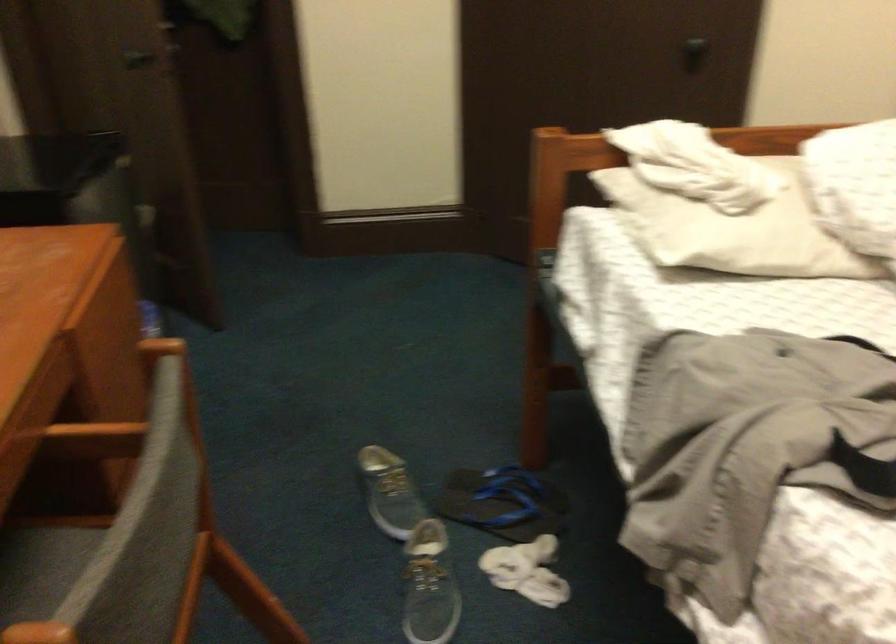
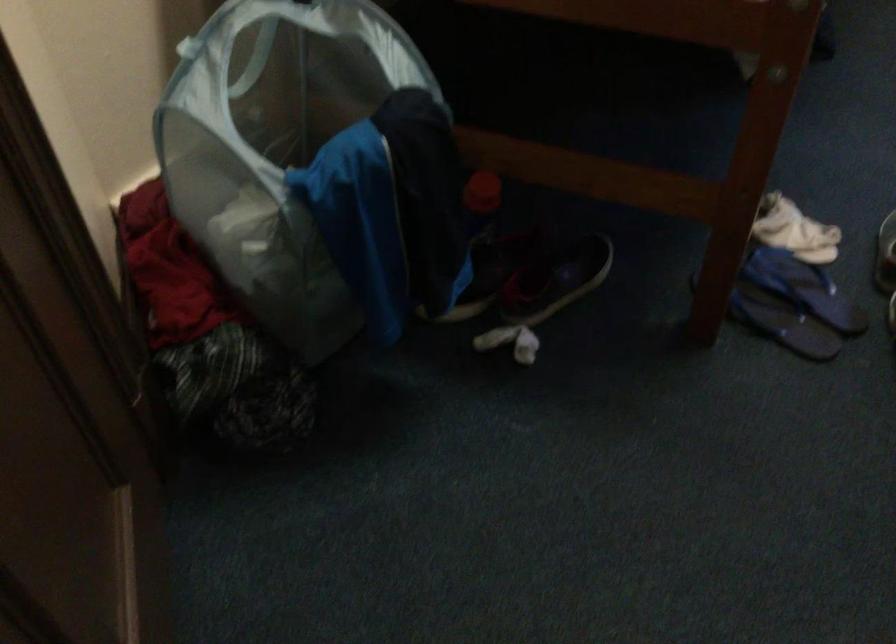
Find the pixel in the second image that matches (x=483, y=518) in the first image.

(804, 288)